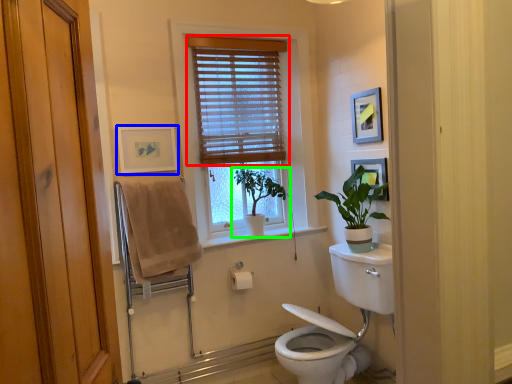
Question: Based on their relative distances, which object is nearer to window blind (highlighted by a red box)? Choose from picture frame (highlighted by a blue box) and houseplant (highlighted by a green box).

Choices:
 (A) picture frame
 (B) houseplant

Answer: (B)